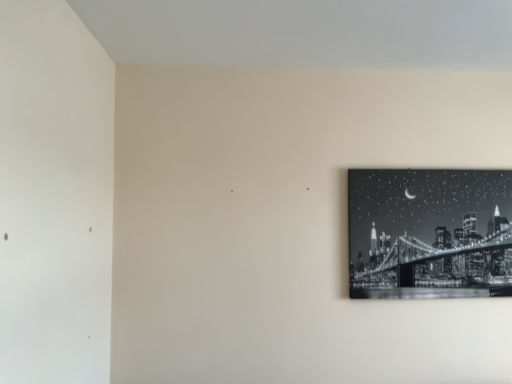
What is the approximate height of black glossy painting at upper right?

It is 24.40 inches.

What do you see at coordinates (430, 233) in the screenshot? I see `black glossy painting at upper right` at bounding box center [430, 233].

The image size is (512, 384). Find the location of `black glossy painting at upper right`. black glossy painting at upper right is located at coordinates (430, 233).

Find the location of a particular element. This screenshot has height=384, width=512. black glossy painting at upper right is located at coordinates (430, 233).